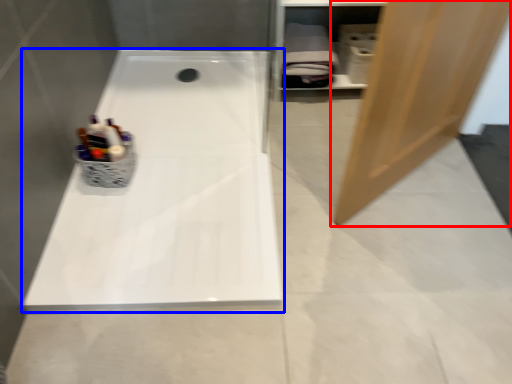
Question: Which point is closer to the camera, door (highlighted by a red box) or bathtub (highlighted by a blue box)?

Choices:
 (A) door
 (B) bathtub

Answer: (A)